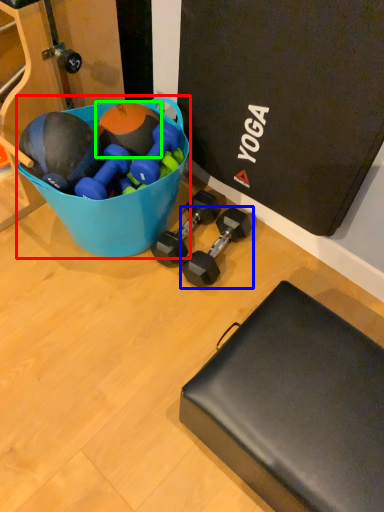
Question: Which object is the farthest from bowl (highlighted by a red box)? Choose among these: dumbbell (highlighted by a blue box) or sports equipment (highlighted by a green box).

Choices:
 (A) dumbbell
 (B) sports equipment

Answer: (A)